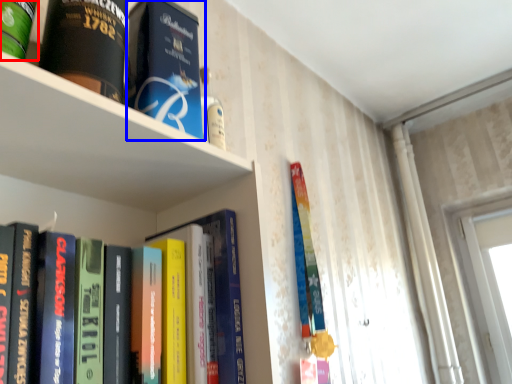
Question: Which object is further to the camera taking this photo, book (highlighted by a red box) or book (highlighted by a blue box)?

Choices:
 (A) book
 (B) book

Answer: (B)